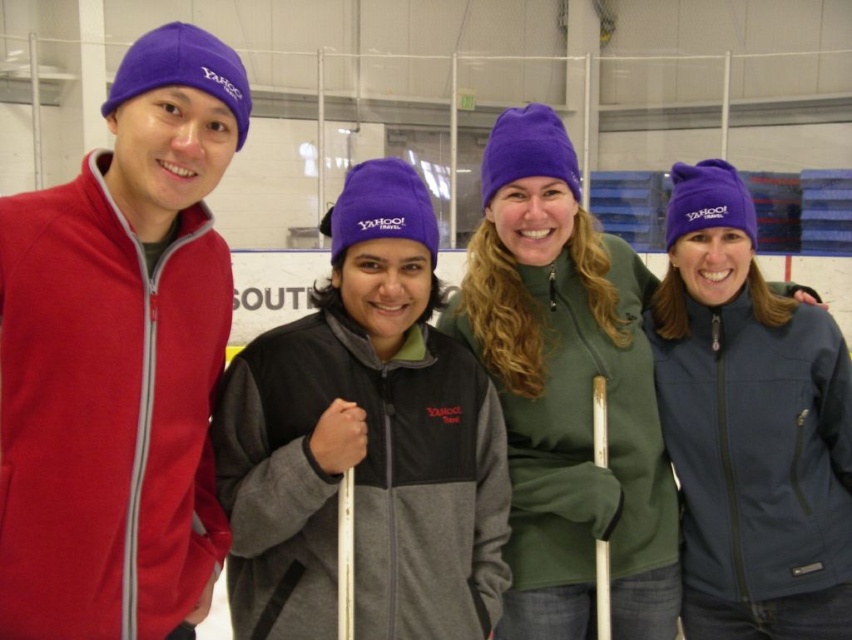
Question: Does matte fleece jacket at left appear on the left side of matte black jacket at center?

Choices:
 (A) no
 (B) yes

Answer: (B)

Question: Which object is positioned farthest from the matte fleece jacket at left?

Choices:
 (A) matte black jacket at center
 (B) navy blue softshell jacket at right

Answer: (B)

Question: Which object appears farthest from the camera in this image?

Choices:
 (A) matte black jacket at center
 (B) green fleece jacket at center
 (C) matte fleece jacket at left

Answer: (B)

Question: Which object appears closest to the camera in this image?

Choices:
 (A) navy blue softshell jacket at right
 (B) matte black jacket at center
 (C) green fleece jacket at center
 (D) matte fleece jacket at left

Answer: (D)

Question: Does matte fleece jacket at left have a greater width compared to navy blue softshell jacket at right?

Choices:
 (A) yes
 (B) no

Answer: (B)

Question: Does matte fleece jacket at left appear over matte black jacket at center?

Choices:
 (A) no
 (B) yes

Answer: (B)